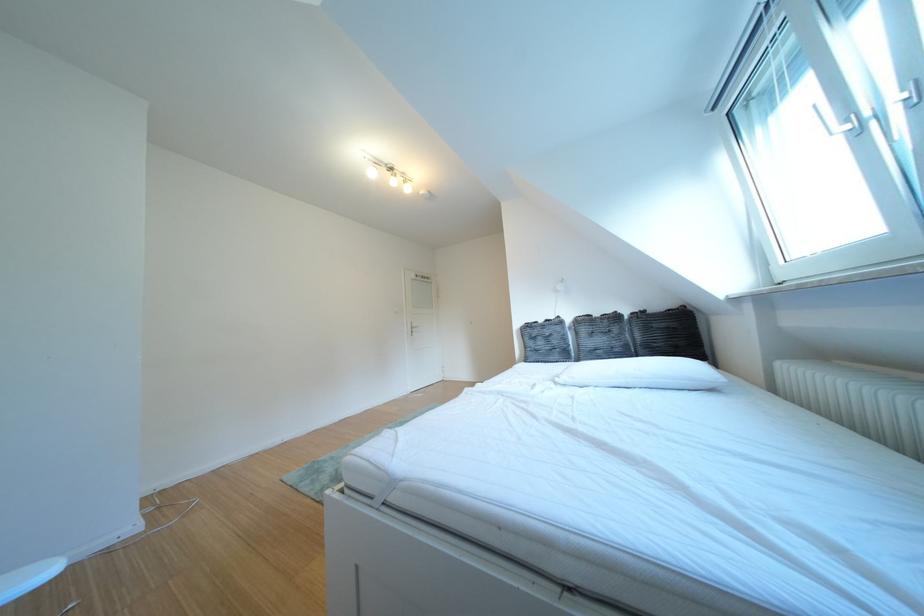
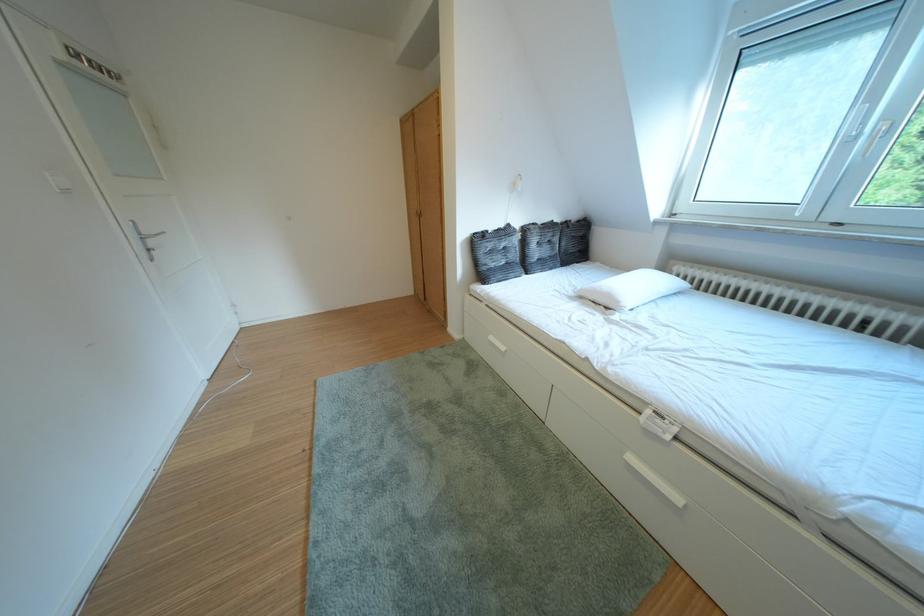
Where in the second image is the point corresponding to (x=671, y=310) from the first image?

(588, 222)